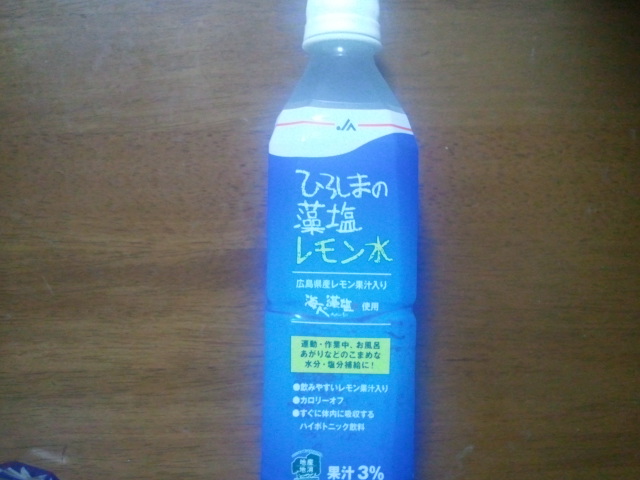
Image resolution: width=640 pixels, height=480 pixels. What are the coordinates of `wood countertop` in the screenshot? It's located at (200, 229).